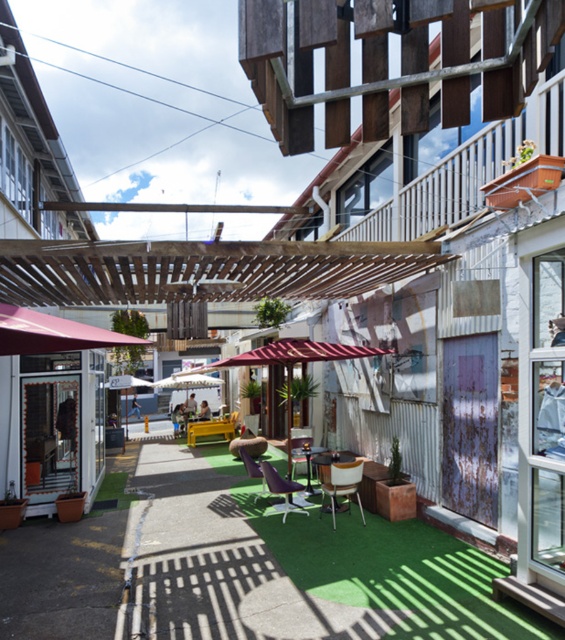
Does white leather chair at center appear under metallic silver chair at center?

No, white leather chair at center is not below metallic silver chair at center.

Which is above, white leather chair at center or metallic silver chair at center?

white leather chair at center

Who is more distant from viewer, (358, 476) or (311, 449)?

Positioned behind is point (311, 449).

Find the location of a particular element. The height and width of the screenshot is (640, 565). white leather chair at center is located at coordinates (341, 483).

Is white leather chair at center smaller than purple fabric chair at center?

No.

Who is shorter, white leather chair at center or purple fabric chair at center?

With less height is purple fabric chair at center.

Who is more distant from viewer, (358,493) or (241,445)?

The point (241,445) is more distant.

Identify the location of white leather chair at center. The width and height of the screenshot is (565, 640). (341, 483).

Can you confirm if purple matte chair at center is shorter than purple fabric chair at center?

In fact, purple matte chair at center may be taller than purple fabric chair at center.

Can you confirm if purple matte chair at center is smaller than purple fabric chair at center?

No.

Who is more distant from viewer, (285,504) or (254,474)?

The point (254,474) is more distant.

The image size is (565, 640). Find the location of `purple matte chair at center`. purple matte chair at center is located at coordinates (281, 488).